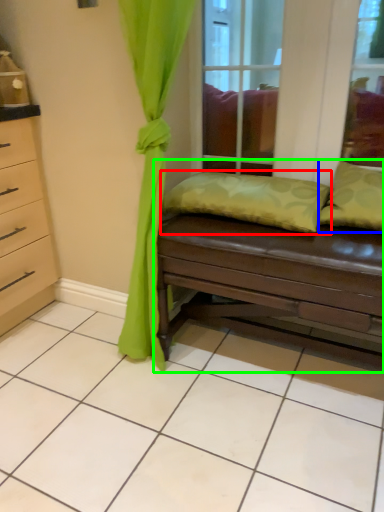
Question: Considering the real-world distances, which object is farthest from pillow (highlighted by a red box)? pillow (highlighted by a blue box) or studio couch (highlighted by a green box)?

Choices:
 (A) pillow
 (B) studio couch

Answer: (A)